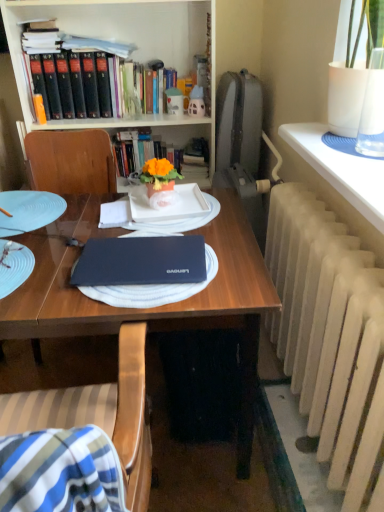
This screenshot has height=512, width=384. Find the location of `vacant space to the right of orange matte flower pot at center`. vacant space to the right of orange matte flower pot at center is located at coordinates (200, 199).